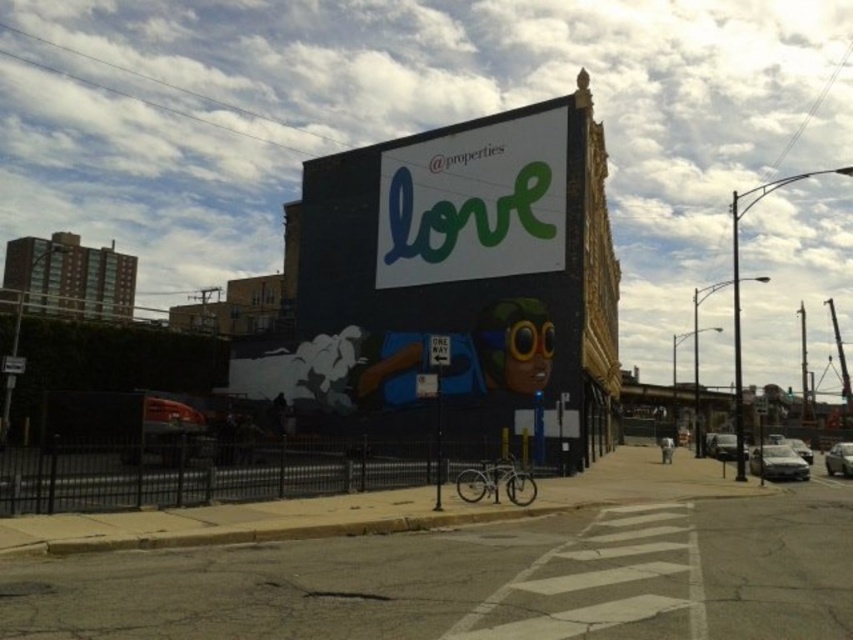
You are standing in front of the building with the mural. You notice two points marked on the wall. One is at coordinate point (422, 353) and the other at point (379, 276). Which point is closer to you?

→ Point (422, 353) is closer to the viewer than point (379, 276).

You are a delivery driver who needs to deliver a package to the address located at point (448,266). The package must be placed on the matte black billboard at center. However, there is a black fence blocking your path. Can you confirm if the billboard is accessible despite the fence?

The matte black billboard at center is located at point (448,266). Since the fence is black, it might be possible to go around it to access the billboard, but the description does not provide details about the fence layout or gaps. Without information on the fence structure, it is uncertain if the billboard is accessible.